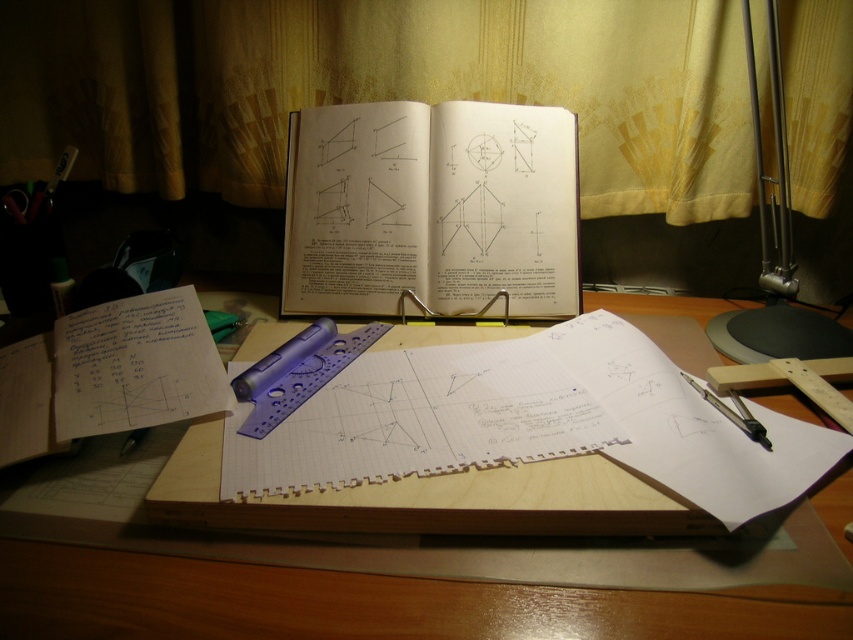
Does wooden desk at center have a greater height compared to metallic silver lamp at upper right?

No.

Between wooden desk at center and metallic silver lamp at upper right, which one appears on the left side from the viewer's perspective?

Positioned to the left is wooden desk at center.

Is point (706, 520) more distant than point (762, 182)?

No, (706, 520) is closer to viewer.

Where is `wooden desk at center`? This screenshot has height=640, width=853. wooden desk at center is located at coordinates click(x=366, y=604).

Does white paper at center appear under metallic silver lamp at upper right?

Correct, white paper at center is located below metallic silver lamp at upper right.

Does white paper at center appear over metallic silver lamp at upper right?

Actually, white paper at center is below metallic silver lamp at upper right.

Who is more distant from viewer, (426,268) or (775,323)?

Point (426,268)

Identify the location of white paper at center. The height and width of the screenshot is (640, 853). (432, 211).

Does metallic silver lamp at upper right have a greater width compared to metallic silver compass at lower right?

Indeed, metallic silver lamp at upper right has a greater width compared to metallic silver compass at lower right.

Can you confirm if metallic silver lamp at upper right is taller than metallic silver compass at lower right?

Correct, metallic silver lamp at upper right is much taller as metallic silver compass at lower right.

Is point (786, 244) farther from camera compared to point (751, 432)?

Yes, point (786, 244) is farther from viewer.

This screenshot has height=640, width=853. Find the location of `metallic silver lamp at upper right`. metallic silver lamp at upper right is located at coordinates (775, 244).